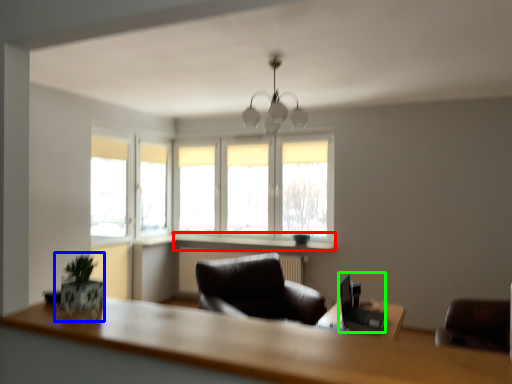
Question: Estimate the real-world distances between objects in this image. Which object is closer to window sill (highlighted by a red box), plant (highlighted by a blue box) or computer desk (highlighted by a green box)?

Choices:
 (A) plant
 (B) computer desk

Answer: (B)